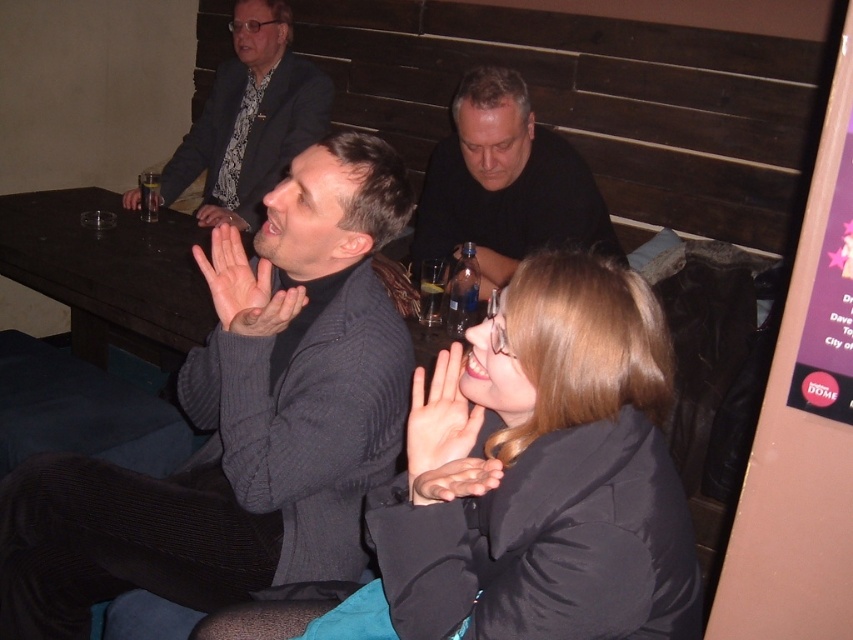
You are a server at the bar and need to deliver a drink to the person in the dark gray sweater at center. The tray you are carrying is 1 meter wide. Can you walk between the two people without spilling the drink?

The two people are 1.34 meters apart, so yes, the server can walk between them with the 1 meter wide tray without spilling the drink since the space is wider than the tray.